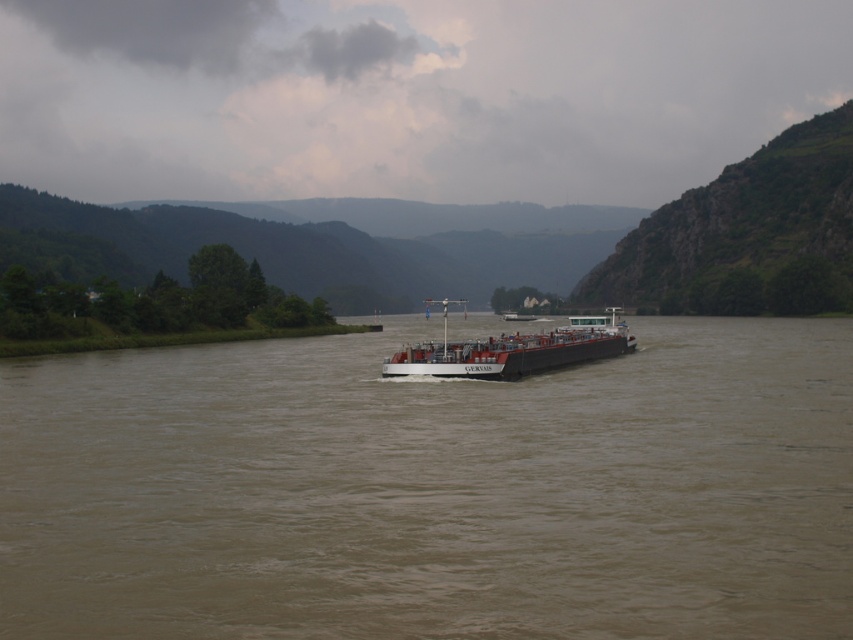
Can you confirm if brown matte river at center is positioned above white matte barge at center?

Incorrect, brown matte river at center is not positioned above white matte barge at center.

Is brown matte river at center to the right of white matte barge at center from the viewer's perspective?

In fact, brown matte river at center is to the left of white matte barge at center.

Find the location of a particular element. brown matte river at center is located at coordinates (432, 490).

Identify the location of brown matte river at center. This screenshot has height=640, width=853. (432, 490).